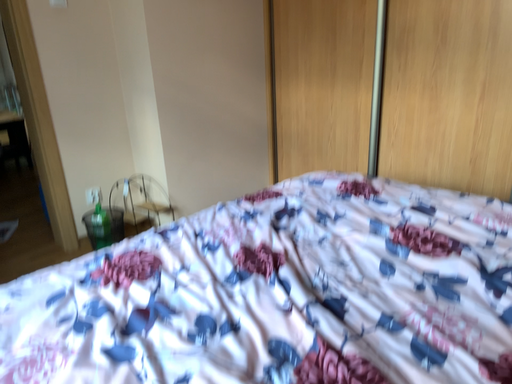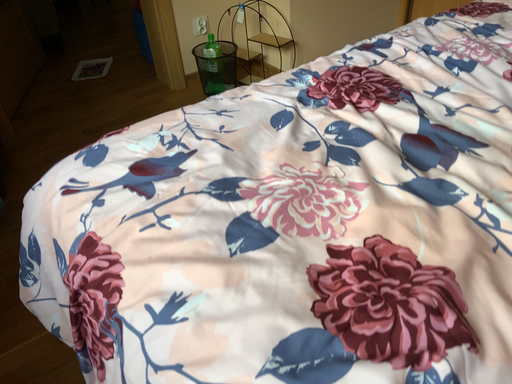
Question: Which way did the camera rotate in the video?

Choices:
 (A) rotated upward
 (B) rotated downward

Answer: (B)